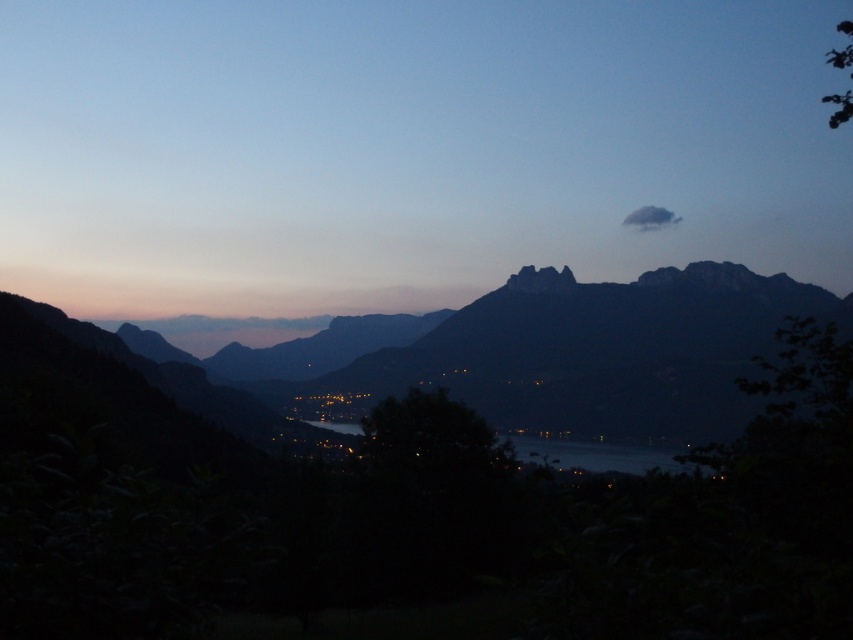
Who is lower down, dark gray rocky mountain range at center or glistening water at center?

glistening water at center

Between point (346, 369) and point (596, 468), which one is positioned behind?

Positioned behind is point (346, 369).

At what (x,y) coordinates should I click in order to perform the action: click on dark gray rocky mountain range at center. Please return your answer as a coordinate pair (x, y). The image size is (853, 640). Looking at the image, I should click on (543, 353).